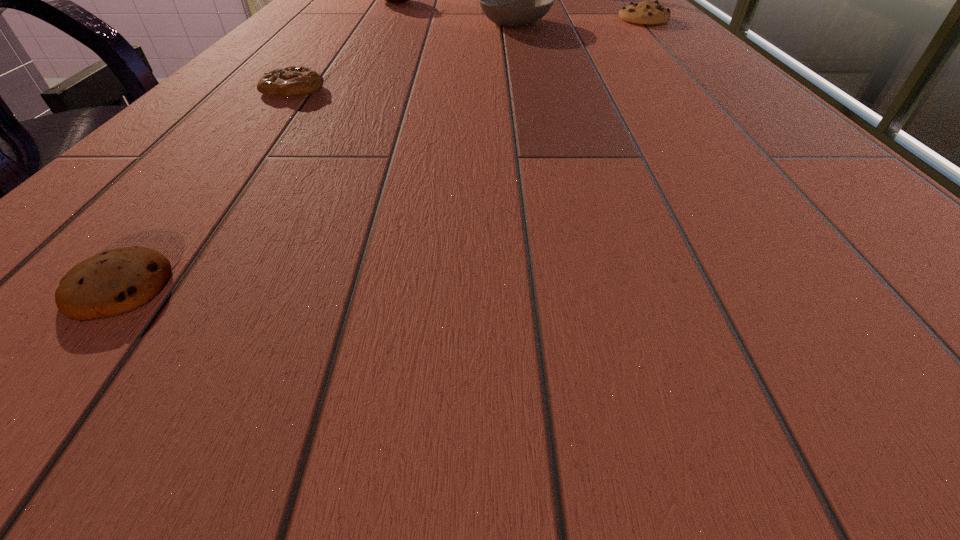
The width and height of the screenshot is (960, 540). Find the location of `object located in the right edge section of the desktop`. object located in the right edge section of the desktop is located at coordinates (645, 12).

Locate an element on the screen. The height and width of the screenshot is (540, 960). free region at the near edge of the desktop is located at coordinates (701, 424).

Identify the location of blank space at the left edge of the desktop. The height and width of the screenshot is (540, 960). (173, 165).

In the image, there is a desktop. Where is `free space at the right edge`? This screenshot has height=540, width=960. free space at the right edge is located at coordinates (x=724, y=90).

At what (x,y) coordinates should I click in order to perform the action: click on unoccupied position between the farthest cookie and the second nearest cookie. Please return your answer as a coordinate pair (x, y). Looking at the image, I should click on click(468, 55).

Locate an element on the screen. free point between the rightmost cookie and the nearest object is located at coordinates (381, 153).

Locate an element on the screen. The height and width of the screenshot is (540, 960). unoccupied area between the tallest cookie and the nearest object is located at coordinates (381, 153).

At what (x,y) coordinates should I click in order to perform the action: click on vacant point located between the rightmost cookie and the second nearest cookie. Please return your answer as a coordinate pair (x, y). This screenshot has height=540, width=960. Looking at the image, I should click on (468, 55).

I want to click on vacant space that is in between the fourth shortest object and the nearest cookie, so click(317, 154).

Locate an element on the screen. Image resolution: width=960 pixels, height=540 pixels. vacant point located between the fourth shortest object and the nearest object is located at coordinates (317, 154).